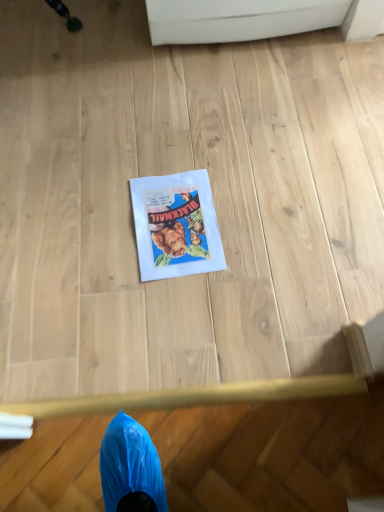
What do you see at coordinates (176, 226) in the screenshot? I see `matte paper coloring book at center` at bounding box center [176, 226].

Locate an element on the screen. The height and width of the screenshot is (512, 384). matte paper coloring book at center is located at coordinates (176, 226).

What are the coordinates of `matte paper coloring book at center` in the screenshot? It's located at (176, 226).